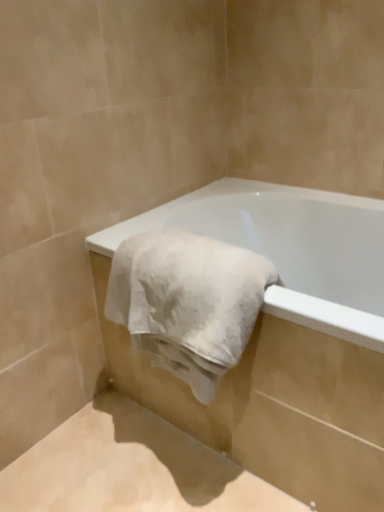
Question: Is white soft towel at center closer to camera compared to white matte bathtub at center?

Choices:
 (A) no
 (B) yes

Answer: (A)

Question: Is white matte bathtub at center at the back of white soft towel at center?

Choices:
 (A) yes
 (B) no

Answer: (A)

Question: From the image's perspective, is white soft towel at center on top of white matte bathtub at center?

Choices:
 (A) no
 (B) yes

Answer: (B)

Question: Can you confirm if white soft towel at center is positioned to the left of white matte bathtub at center?

Choices:
 (A) no
 (B) yes

Answer: (B)

Question: Considering the relative sizes of white soft towel at center and white matte bathtub at center in the image provided, is white soft towel at center taller than white matte bathtub at center?

Choices:
 (A) no
 (B) yes

Answer: (A)

Question: Does white soft towel at center touch white matte bathtub at center?

Choices:
 (A) no
 (B) yes

Answer: (A)

Question: Is white matte bathtub at center outside white soft towel at center?

Choices:
 (A) yes
 (B) no

Answer: (A)

Question: Can you confirm if white matte bathtub at center is smaller than white soft towel at center?

Choices:
 (A) yes
 (B) no

Answer: (B)

Question: Is white matte bathtub at center to the left of white soft towel at center from the viewer's perspective?

Choices:
 (A) yes
 (B) no

Answer: (B)

Question: Does white matte bathtub at center have a greater height compared to white soft towel at center?

Choices:
 (A) yes
 (B) no

Answer: (A)

Question: Considering the relative sizes of white matte bathtub at center and white soft towel at center in the image provided, is white matte bathtub at center bigger than white soft towel at center?

Choices:
 (A) no
 (B) yes

Answer: (B)

Question: Does white matte bathtub at center have a greater width compared to white soft towel at center?

Choices:
 (A) no
 (B) yes

Answer: (B)

Question: From the image's perspective, is white matte bathtub at center positioned above or below white soft towel at center?

Choices:
 (A) below
 (B) above

Answer: (A)